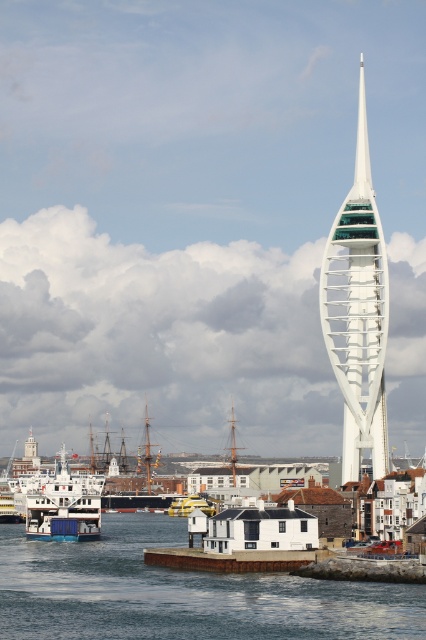
You are a tourist standing at the harbor and want to take a photo of the white metallic tower at center. Considering the distance, do you think you can capture the entire tower in your smartphone camera without moving closer or further away?

The white metallic tower at center is 515.34 meters away from the viewer. Since most smartphone cameras have a wide enough angle to capture distant tall structures at that distance, you should be able to capture the entire tower without needing to move closer or further away.

You are a photographer planning to capture both the white glossy ferry at lower left and the yellow rubber boat at center in a single shot. Which boat should you position closer to the camera to ensure both are fully visible in the frame?

Since the white glossy ferry at lower left is much taller than the yellow rubber boat at center, you should position the yellow rubber boat at center closer to the camera to balance their sizes in the photograph.

You are a photographer planning to capture the white metallic tower at center and the yellow rubber boat at center in the same frame. Given their height difference, which object will appear larger in your photo?

The white metallic tower at center will appear larger in the photo because it is much taller than the yellow rubber boat at center.